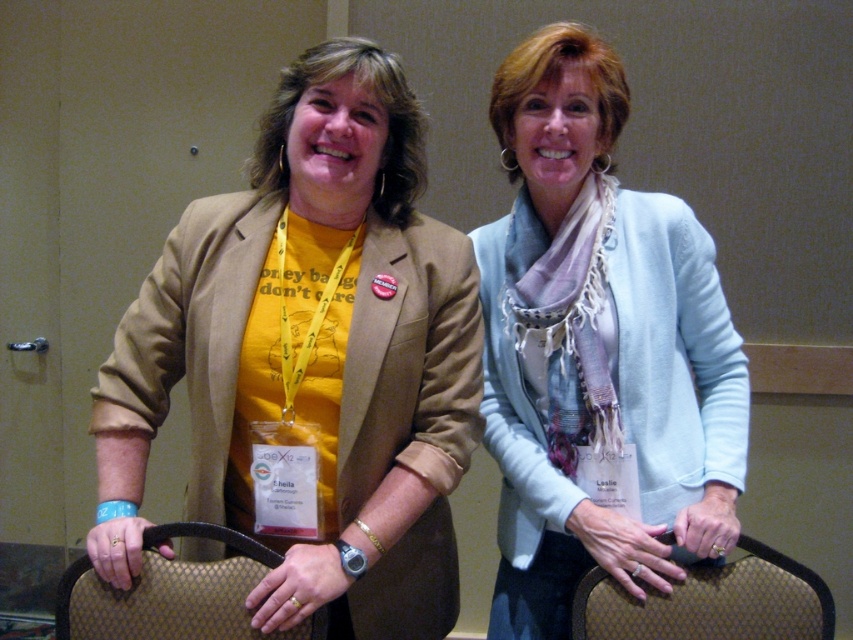
Question: Which of the following is the closest to the observer?

Choices:
 (A) (253, 556)
 (B) (386, 275)
 (C) (549, 60)
 (D) (788, 637)

Answer: (A)

Question: Can you confirm if light blue sweater at center is positioned below brown textured chair at lower right?

Choices:
 (A) no
 (B) yes

Answer: (A)

Question: Does matte brown blazer at center have a greater width compared to light blue sweater at center?

Choices:
 (A) no
 (B) yes

Answer: (B)

Question: Which point is farther to the camera?

Choices:
 (A) brown textured bag at lower center
 (B) matte brown blazer at center
 (C) light blue sweater at center
 (D) brown textured chair at lower right

Answer: (C)

Question: Which point appears closest to the camera in this image?

Choices:
 (A) (212, 396)
 (B) (184, 529)

Answer: (B)

Question: Does matte brown blazer at center have a larger size compared to brown textured chair at lower right?

Choices:
 (A) yes
 (B) no

Answer: (A)